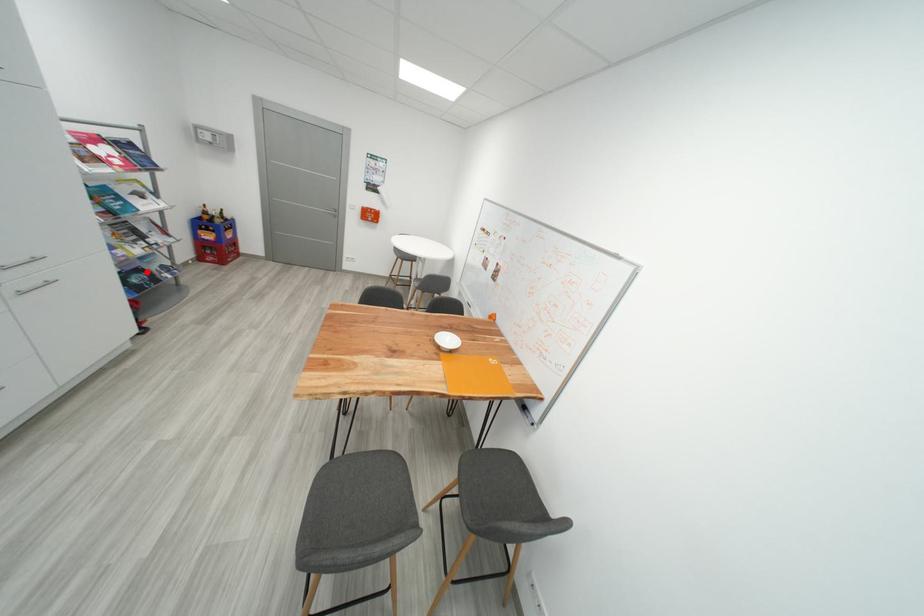
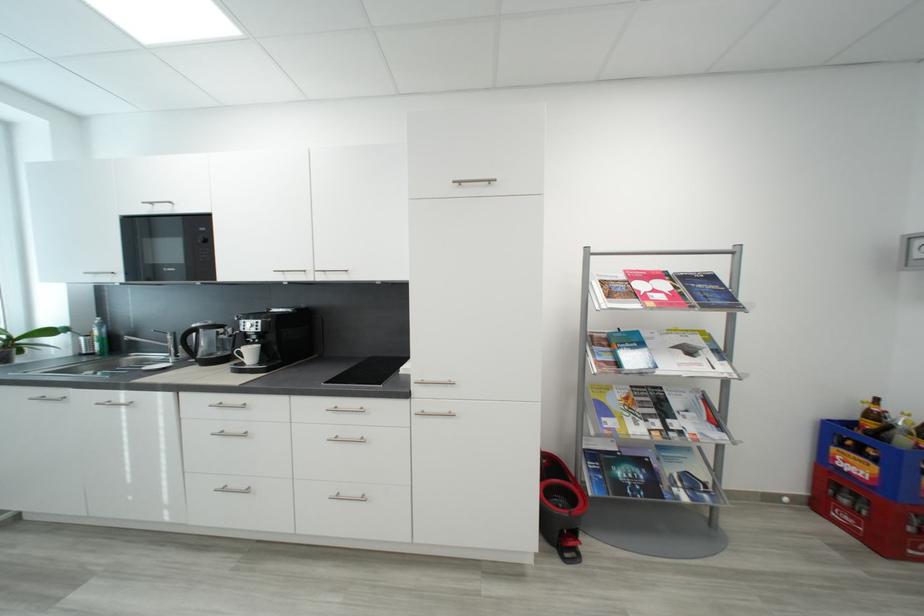
Question: I am providing you with two images of the same scene from different viewpoints. In image1, a red point is highlighted. Considering the same 3D point in image2, which of the following is correct?

Choices:
 (A) It is closer
 (B) It is farther

Answer: (B)